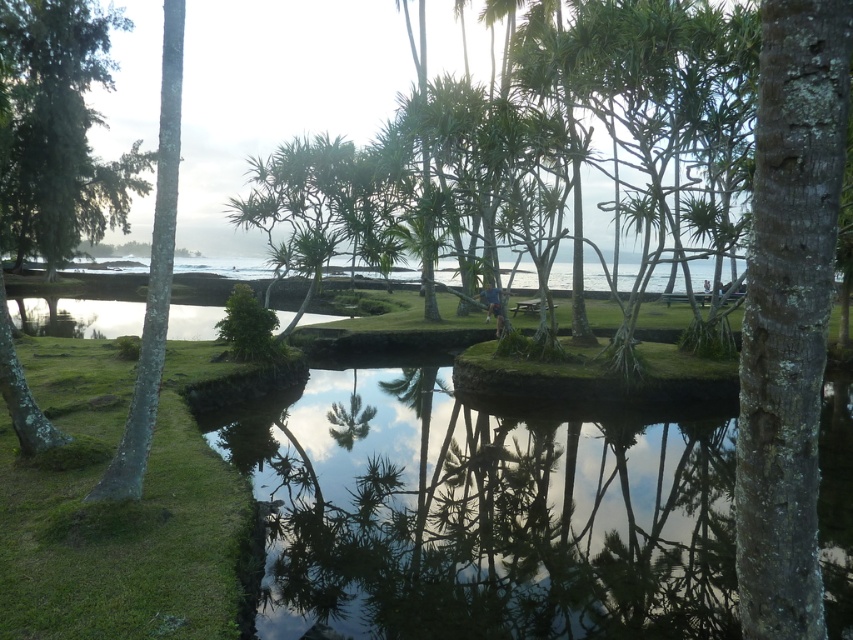
Between point (821, 304) and point (122, 198), which one is positioned in front?

Positioned in front is point (821, 304).

Is lichen-covered bark tree at center-right taller than green leafy tree at upper left?

In fact, lichen-covered bark tree at center-right may be shorter than green leafy tree at upper left.

What do you see at coordinates (788, 312) in the screenshot? I see `lichen-covered bark tree at center-right` at bounding box center [788, 312].

The width and height of the screenshot is (853, 640). I want to click on lichen-covered bark tree at center-right, so 788,312.